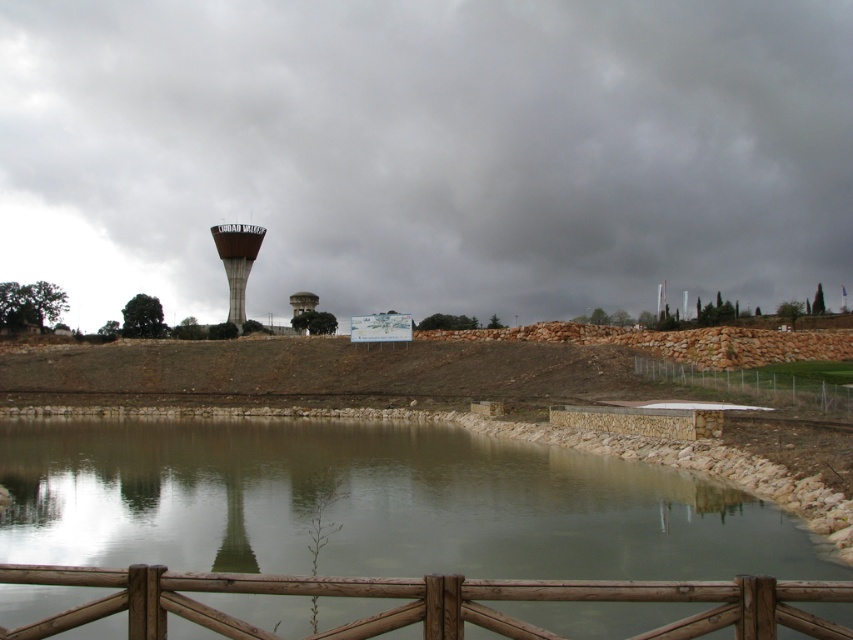
You are standing at the edge of the water and want to reach the brown wooden rail at lower center. Which direction should you move relative to the metallic gray water tower at center?

You should move to the right relative to the metallic gray water tower at center to reach the brown wooden rail at lower center, as it is positioned to the right of the water tower.

In the scene shown: You are standing at the point marked by the coordinates (424,602) in the image. What object is exactly at that location?

The brown wooden rail at lower center is located at point (424,602).